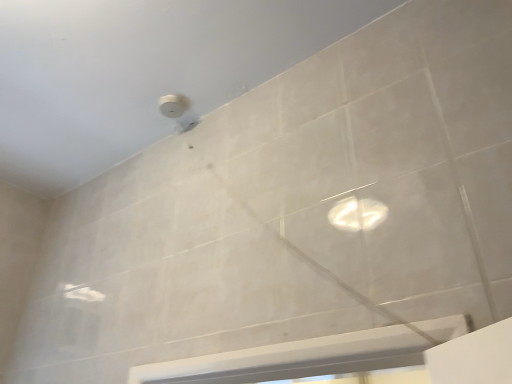
I want to click on white plastic droplight at upper center, so click(173, 105).

Measure the distance between point [181,110] and camera.

Point [181,110] and camera are 4.68 feet apart from each other.

This screenshot has height=384, width=512. Describe the element at coordinates (173, 105) in the screenshot. I see `white plastic droplight at upper center` at that location.

What is the approximate width of white plastic droplight at upper center?

3.71 inches.

At what (x,y) coordinates should I click in order to perform the action: click on white plastic droplight at upper center. Please return your answer as a coordinate pair (x, y). Looking at the image, I should click on (173, 105).